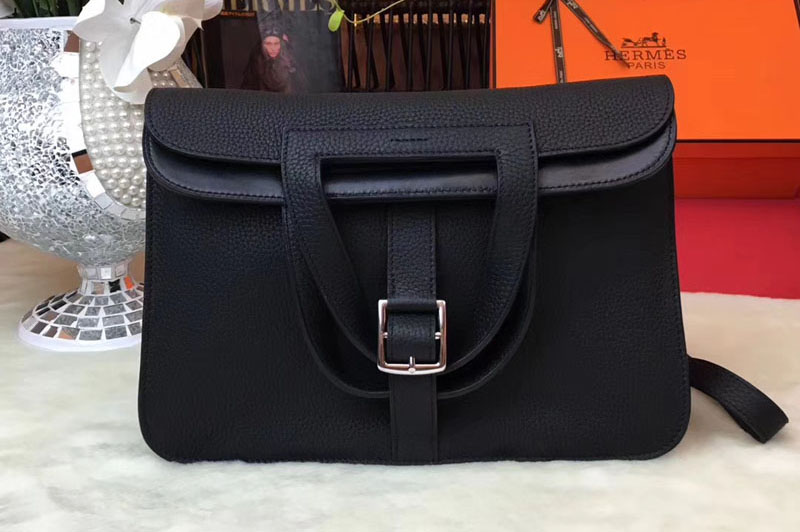
Identify the location of glass chalice. The image size is (800, 532). click(x=72, y=181).